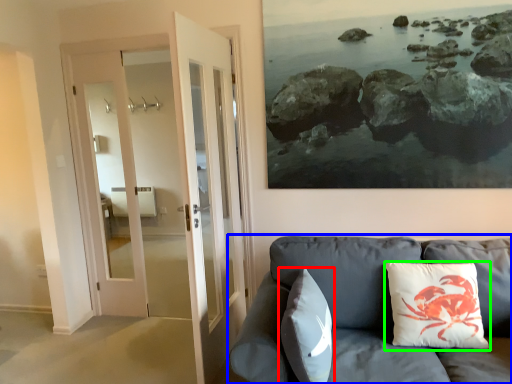
Question: Based on their relative distances, which object is nearer to pillow (highlighted by a red box)? Choose from studio couch (highlighted by a blue box) and pillow (highlighted by a green box).

Choices:
 (A) studio couch
 (B) pillow

Answer: (A)